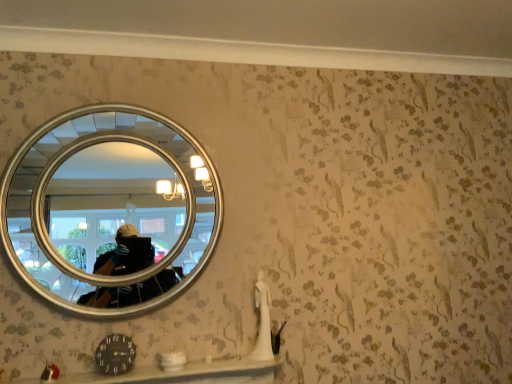
Measure the distance between point (192, 160) and camera.

Point (192, 160) and camera are 6.10 feet apart from each other.

Image resolution: width=512 pixels, height=384 pixels. Find the location of `silver/metallic mirror at upper left`. silver/metallic mirror at upper left is located at coordinates (109, 208).

Describe the element at coordinates (109, 208) in the screenshot. I see `silver/metallic mirror at upper left` at that location.

What do you see at coordinates (189, 374) in the screenshot?
I see `smooth white ledge at lower center` at bounding box center [189, 374].

Find the location of `smooth white ledge at lower center`. smooth white ledge at lower center is located at coordinates (189, 374).

Where is `silver/metallic mirror at upper left`? Image resolution: width=512 pixels, height=384 pixels. silver/metallic mirror at upper left is located at coordinates (109, 208).

In the scene shown: Between silver/metallic mirror at upper left and smooth white ledge at lower center, which one appears on the right side from the viewer's perspective?

Positioned to the right is smooth white ledge at lower center.

Considering their positions, is silver/metallic mirror at upper left located in front of or behind smooth white ledge at lower center?

In the image, silver/metallic mirror at upper left appears behind smooth white ledge at lower center.

Is point (178, 236) closer or farther from the camera than point (269, 362)?

Clearly, point (178, 236) is more distant from the camera than point (269, 362).

From the image's perspective, is silver/metallic mirror at upper left beneath smooth white ledge at lower center?

No, from the image's perspective, silver/metallic mirror at upper left is not beneath smooth white ledge at lower center.

From a real-world perspective, is silver/metallic mirror at upper left beneath smooth white ledge at lower center?

No.

Which object is thinner, silver/metallic mirror at upper left or smooth white ledge at lower center?

Thinner between the two is silver/metallic mirror at upper left.

Is silver/metallic mirror at upper left taller than smooth white ledge at lower center?

Indeed, silver/metallic mirror at upper left has a greater height compared to smooth white ledge at lower center.

In the scene shown: Who is bigger, silver/metallic mirror at upper left or smooth white ledge at lower center?

With larger size is silver/metallic mirror at upper left.

Is silver/metallic mirror at upper left located outside smooth white ledge at lower center?

Yes, silver/metallic mirror at upper left is outside of smooth white ledge at lower center.

Are silver/metallic mirror at upper left and smooth white ledge at lower center making contact?

No, silver/metallic mirror at upper left is not with smooth white ledge at lower center.

Is silver/metallic mirror at upper left looking in the opposite direction of smooth white ledge at lower center?

No, silver/metallic mirror at upper left is not facing away from smooth white ledge at lower center.

How many degrees apart are the facing directions of silver/metallic mirror at upper left and smooth white ledge at lower center?

0.000309 degrees.

How distant is silver/metallic mirror at upper left from smooth white ledge at lower center?

The distance of silver/metallic mirror at upper left from smooth white ledge at lower center is 21.83 inches.

Identify the location of mirror that is above the smooth white ledge at lower center (from the image's perspective). (109, 208).

Based on their positions, is smooth white ledge at lower center located to the left or right of silver/metallic mirror at upper left?

Based on their positions, smooth white ledge at lower center is located to the right of silver/metallic mirror at upper left.

Is smooth white ledge at lower center further to camera compared to silver/metallic mirror at upper left?

No.

Is point (90, 382) in front of point (44, 267)?

Yes, it is.

From the image's perspective, is smooth white ledge at lower center above or below silver/metallic mirror at upper left?

Based on their image positions, smooth white ledge at lower center is located beneath silver/metallic mirror at upper left.

From a real-world perspective, is smooth white ledge at lower center beneath silver/metallic mirror at upper left?

Yes, from a real-world perspective, smooth white ledge at lower center is below silver/metallic mirror at upper left.

Which object is wider, smooth white ledge at lower center or silver/metallic mirror at upper left?

smooth white ledge at lower center.

Which of these two, smooth white ledge at lower center or silver/metallic mirror at upper left, stands taller?

With more height is silver/metallic mirror at upper left.

Who is smaller, smooth white ledge at lower center or silver/metallic mirror at upper left?

smooth white ledge at lower center is smaller.

Is smooth white ledge at lower center located outside silver/metallic mirror at upper left?

smooth white ledge at lower center lies outside silver/metallic mirror at upper left's area.

Would you say smooth white ledge at lower center is a long distance from silver/metallic mirror at upper left?

No, smooth white ledge at lower center is not far from silver/metallic mirror at upper left.

Is smooth white ledge at lower center positioned with its back to silver/metallic mirror at upper left?

No, smooth white ledge at lower center's orientation is not away from silver/metallic mirror at upper left.

What's the angular difference between smooth white ledge at lower center and silver/metallic mirror at upper left's facing directions?

There is a 0.000309-degree angle between the facing directions of smooth white ledge at lower center and silver/metallic mirror at upper left.

You are a GUI agent. You are given a task and a screenshot of the screen. Output one action in this format:
    pyautogui.click(x=<x>, y=<y>)
    Task: Click on the ledge that is under the silver/metallic mirror at upper left (from a real-world perspective)
    Image resolution: width=512 pixels, height=384 pixels.
    Given the screenshot: What is the action you would take?
    pyautogui.click(x=189, y=374)

Where is `mirror above the smooth white ledge at lower center (from a real-world perspective)`? The width and height of the screenshot is (512, 384). mirror above the smooth white ledge at lower center (from a real-world perspective) is located at coordinates (109, 208).

This screenshot has width=512, height=384. In the image, there is a silver/metallic mirror at upper left. Identify the location of ledge below it (from the image's perspective). (189, 374).